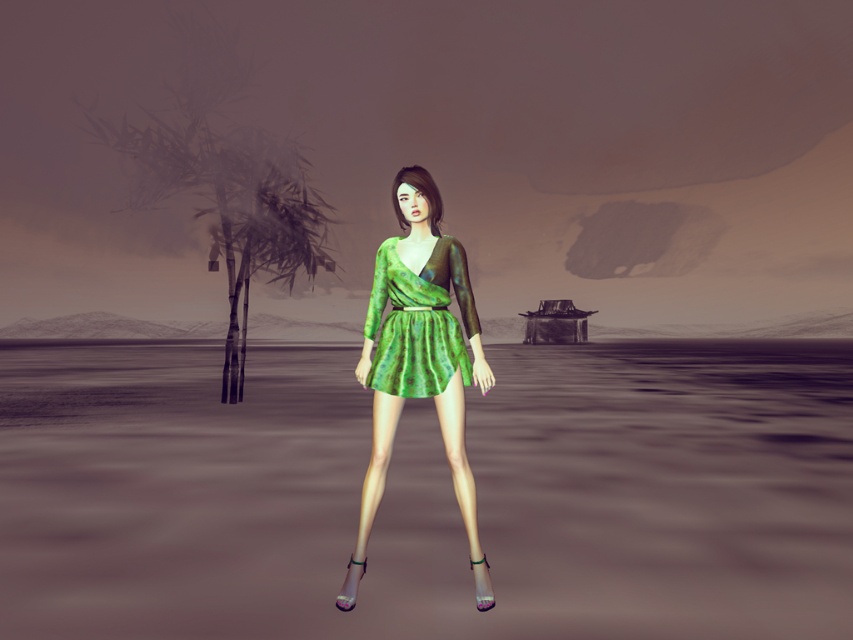
From the picture: Who is shorter, green glossy water at center or green textured dress at center?

With less height is green glossy water at center.

Is green glossy water at center positioned before green textured dress at center?

Yes.

Which is behind, point (589, 397) or point (430, 355)?

The point (589, 397) is behind.

Where is `green glossy water at center`? green glossy water at center is located at coordinates (427, 493).

Is point (170, 388) positioned after point (456, 417)?

Yes.

Is the position of green glossy water at center less distant than that of green shiny dress at center?

Yes, green glossy water at center is in front of green shiny dress at center.

The image size is (853, 640). Identify the location of green glossy water at center. (427, 493).

Between green shiny dress at center and green textured dress at center, which one has more height?

Standing taller between the two is green shiny dress at center.

Where is `green shiny dress at center`? This screenshot has height=640, width=853. green shiny dress at center is located at coordinates (419, 358).